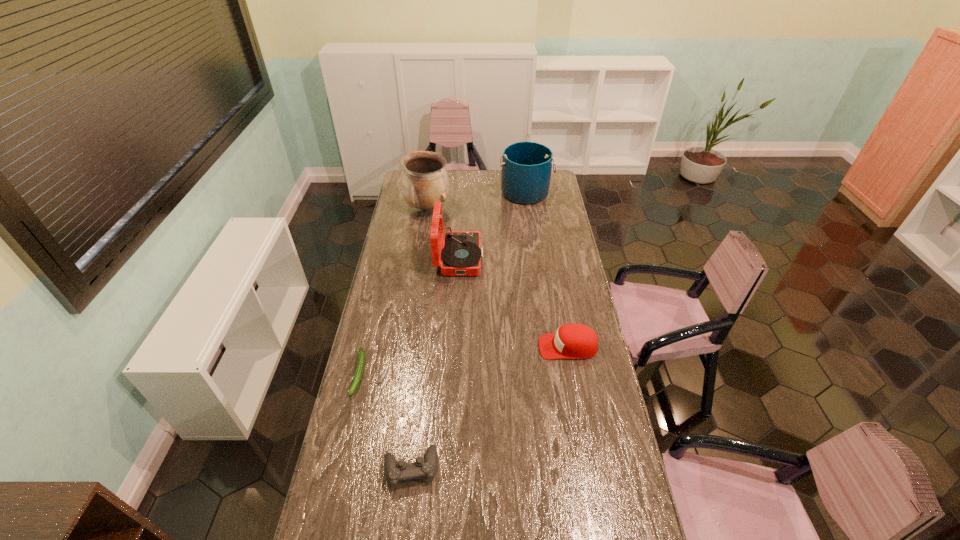
You are a GUI agent. You are given a task and a screenshot of the screen. Output one action in this format:
    pyautogui.click(x=<x>, y=<y>)
    Task: Click on the urn
    This screenshot has height=540, width=960.
    Given the screenshot: What is the action you would take?
    pyautogui.click(x=425, y=181)

The height and width of the screenshot is (540, 960). Find the location of `bucket`. bucket is located at coordinates (526, 166).

The height and width of the screenshot is (540, 960). I want to click on the third farthest object, so click(461, 254).

At what (x,y) coordinates should I click in order to perform the action: click on baseball cap. Please return your answer as a coordinate pair (x, y). Image resolution: width=960 pixels, height=540 pixels. Looking at the image, I should click on (571, 341).

Where is `the fifth tallest object`? Image resolution: width=960 pixels, height=540 pixels. the fifth tallest object is located at coordinates (396, 472).

This screenshot has height=540, width=960. What are the coordinates of `the nearest object` in the screenshot? It's located at (396, 472).

In order to click on the shortest object in this screenshot , I will do `click(361, 354)`.

Identify the location of zucchini. The image size is (960, 540). (361, 354).

Where is `free space located on the back of the urn`? This screenshot has width=960, height=540. free space located on the back of the urn is located at coordinates (432, 181).

Locate an element on the screen. The width and height of the screenshot is (960, 540). vacant space situated on the front of the bucket is located at coordinates (530, 225).